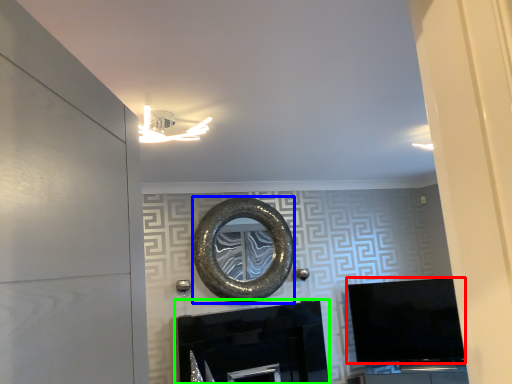
Question: Based on their relative distances, which object is nearer to television (highlighted by a red box)? Choose from oval (highlighted by a blue box) and fireplace (highlighted by a green box).

Choices:
 (A) oval
 (B) fireplace

Answer: (B)